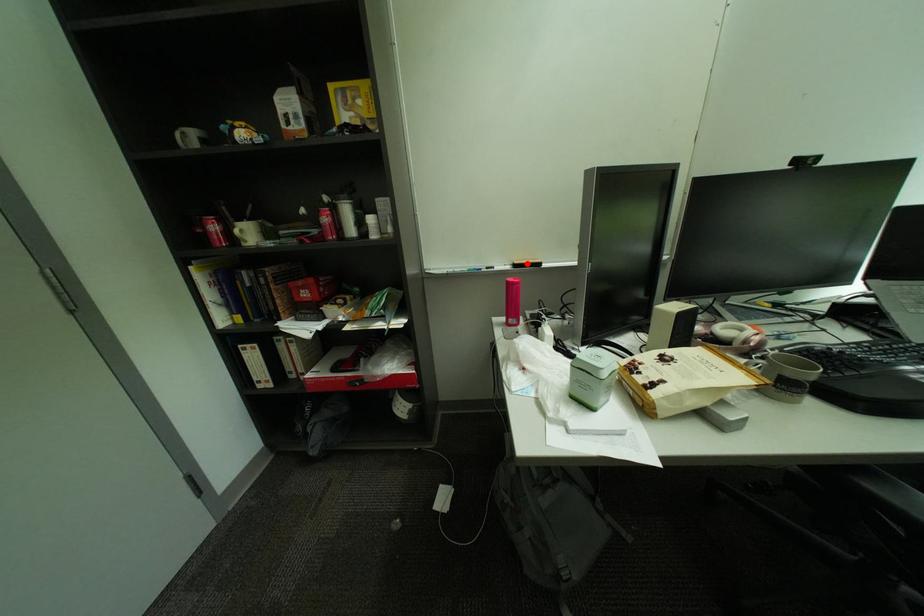
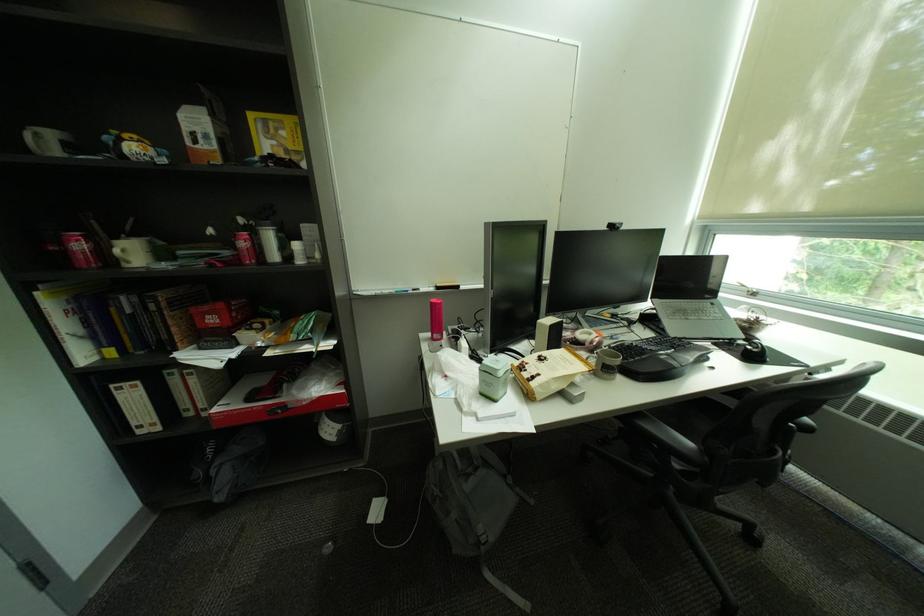
Find the pixel in the second image that matches the highlighted location in the first image.

(450, 286)